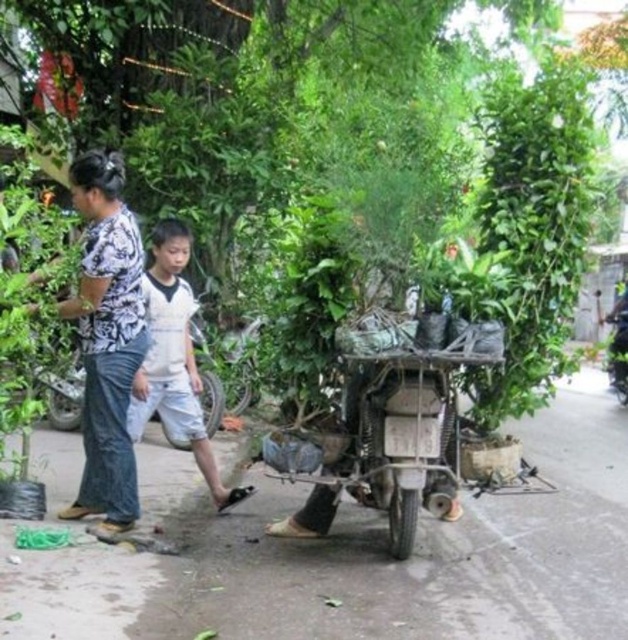
Question: Is the position of white cotton shirt at center more distant than that of metallic silver tricycle at center?

Choices:
 (A) no
 (B) yes

Answer: (A)

Question: Can you confirm if printed fabric shirt at center is wider than white cotton shirt at center?

Choices:
 (A) yes
 (B) no

Answer: (B)

Question: Which point is farther to the camera?

Choices:
 (A) (614, 314)
 (B) (107, 465)
 (C) (197, 438)

Answer: (A)

Question: Is white cotton shirt at center behind metallic silver tricycle at center?

Choices:
 (A) no
 (B) yes

Answer: (A)

Question: Which of the following is the closest to the observer?

Choices:
 (A) (622, 396)
 (B) (129, 371)
 (C) (197, 408)

Answer: (B)

Question: Which point is farther from the camera taking this photo?

Choices:
 (A) (617, 348)
 (B) (82, 193)

Answer: (A)